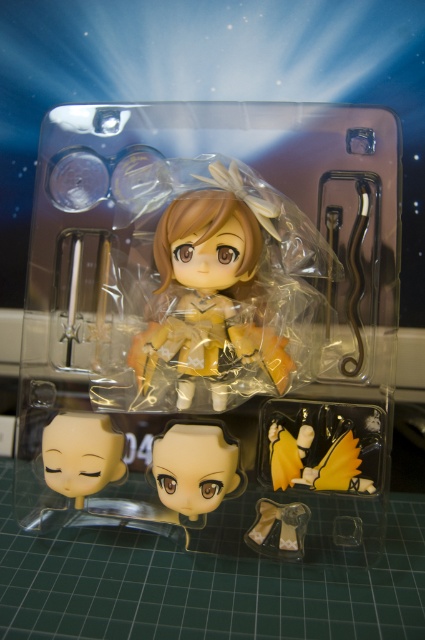
Does translucent plastic head at center have a lesser height compared to yellow matte hair clip at lower right?

No.

Between point (227, 474) and point (269, 445), which one is positioned in front?

Point (227, 474)

Who is more distant from viewer, (163, 467) or (271, 433)?

Point (271, 433)

You are a GUI agent. You are given a task and a screenshot of the screen. Output one action in this format:
    pyautogui.click(x=<x>, y=<y>)
    Task: Click on the translucent plastic head at center
    This screenshot has width=425, height=640.
    Given the screenshot: What is the action you would take?
    pyautogui.click(x=195, y=468)

Does translucent plastic head at center appear under matte beige fabric skirt at lower center?

Incorrect, translucent plastic head at center is not positioned below matte beige fabric skirt at lower center.

Measure the distance between point (158,483) and camera.

Point (158,483) and camera are 3.67 feet apart.

Who is more distant from viewer, (223, 492) or (246, 538)?

The point (246, 538) is more distant.

Identify the location of translucent plastic head at center. Image resolution: width=425 pixels, height=640 pixels. (195, 468).

Is translucent plastic figure at center shorter than matte beige fabric skirt at lower center?

No, translucent plastic figure at center is not shorter than matte beige fabric skirt at lower center.

In the scene shown: Which is more to the right, translucent plastic figure at center or matte beige fabric skirt at lower center?

From the viewer's perspective, matte beige fabric skirt at lower center appears more on the right side.

Image resolution: width=425 pixels, height=640 pixels. Identify the location of translucent plastic figure at center. (217, 316).

Where is `translucent plastic figure at center`? This screenshot has width=425, height=640. translucent plastic figure at center is located at coordinates (217, 316).